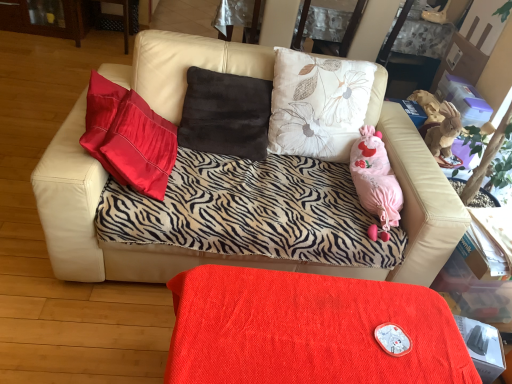
I want to click on empty space that is ontop of velvet red table at lower center (from a real-world perspective), so click(323, 321).